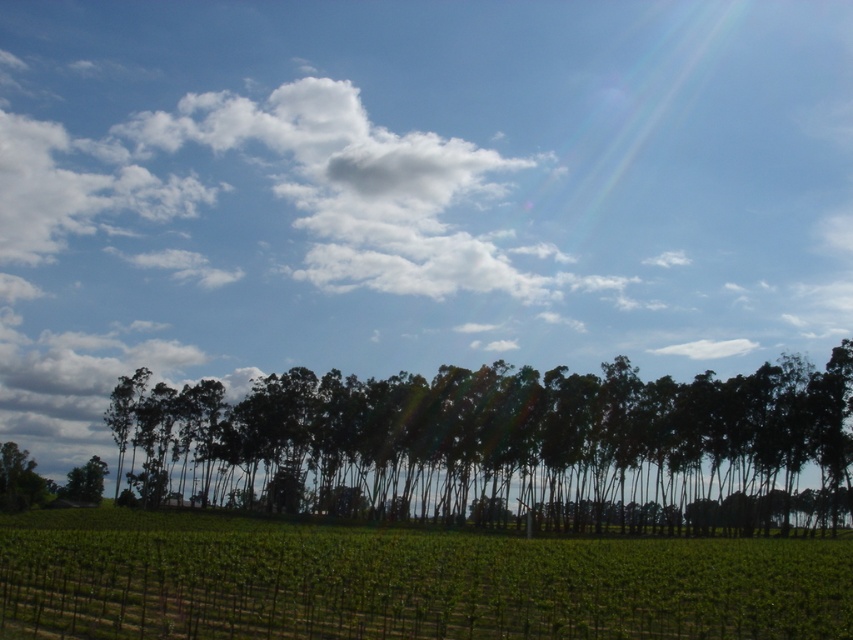
Can you confirm if dark green trees at center is thinner than green leafy vineyard at center?

In fact, dark green trees at center might be wider than green leafy vineyard at center.

You are a GUI agent. You are given a task and a screenshot of the screen. Output one action in this format:
    pyautogui.click(x=<x>, y=<y>)
    Task: Click on the dark green trees at center
    
    Given the screenshot: What is the action you would take?
    pyautogui.click(x=509, y=445)